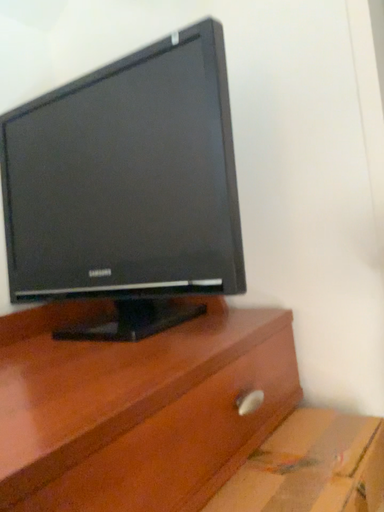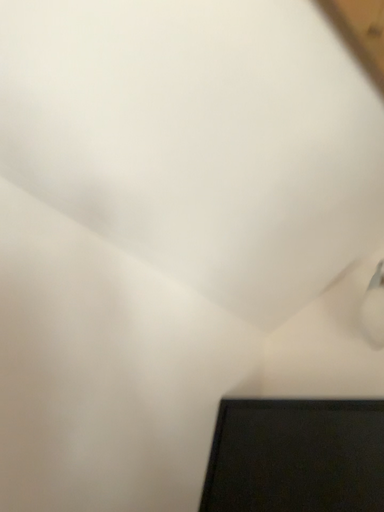
Question: Which way did the camera rotate in the video?

Choices:
 (A) rotated right
 (B) rotated left

Answer: (B)